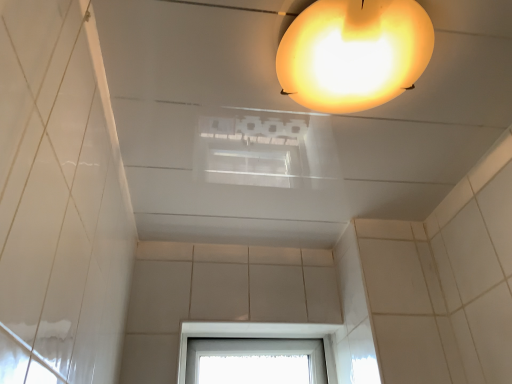
Question: Does transparent glass window at lower center have a greater width compared to translucent yellow lampshade at upper center?

Choices:
 (A) no
 (B) yes

Answer: (A)

Question: Is transparent glass window at lower center not inside translucent yellow lampshade at upper center?

Choices:
 (A) yes
 (B) no

Answer: (A)

Question: Is transparent glass window at lower center facing towards translucent yellow lampshade at upper center?

Choices:
 (A) yes
 (B) no

Answer: (B)

Question: Considering the relative positions of transparent glass window at lower center and translucent yellow lampshade at upper center in the image provided, is transparent glass window at lower center behind translucent yellow lampshade at upper center?

Choices:
 (A) yes
 (B) no

Answer: (A)

Question: From a real-world perspective, is transparent glass window at lower center below translucent yellow lampshade at upper center?

Choices:
 (A) no
 (B) yes

Answer: (B)

Question: Can you confirm if transparent glass window at lower center is smaller than translucent yellow lampshade at upper center?

Choices:
 (A) no
 (B) yes

Answer: (A)

Question: From the image's perspective, is translucent yellow lampshade at upper center above transparent glass window at lower center?

Choices:
 (A) no
 (B) yes

Answer: (B)

Question: Considering the relative sizes of translucent yellow lampshade at upper center and transparent glass window at lower center in the image provided, is translucent yellow lampshade at upper center smaller than transparent glass window at lower center?

Choices:
 (A) no
 (B) yes

Answer: (B)

Question: Is there a large distance between translucent yellow lampshade at upper center and transparent glass window at lower center?

Choices:
 (A) no
 (B) yes

Answer: (A)

Question: Would you say translucent yellow lampshade at upper center is outside transparent glass window at lower center?

Choices:
 (A) no
 (B) yes

Answer: (B)

Question: Is translucent yellow lampshade at upper center in front of transparent glass window at lower center?

Choices:
 (A) no
 (B) yes

Answer: (B)

Question: Is translucent yellow lampshade at upper center at the left side of transparent glass window at lower center?

Choices:
 (A) no
 (B) yes

Answer: (A)

Question: From a real-world perspective, is translucent yellow lampshade at upper center positioned above or below transparent glass window at lower center?

Choices:
 (A) above
 (B) below

Answer: (A)